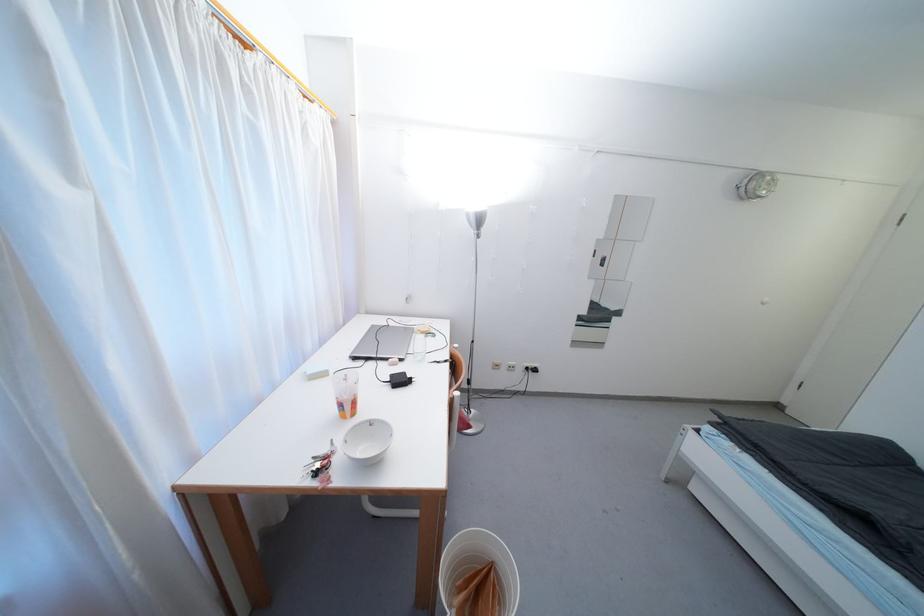
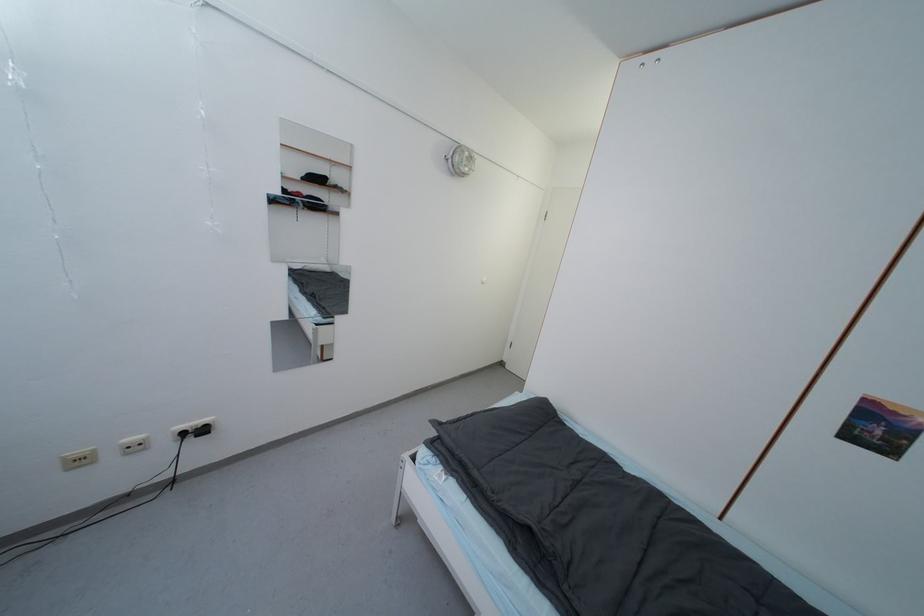
In the second image, find the point that corresponds to point (531, 371) in the first image.

(187, 436)